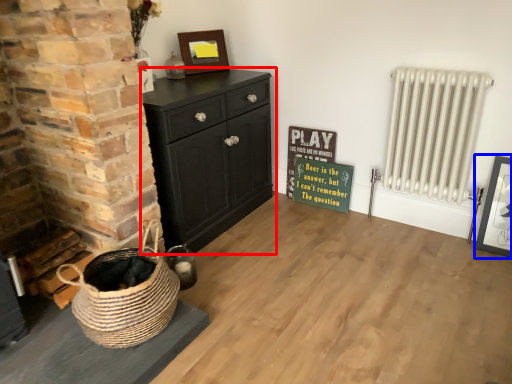
Question: Which point is further to the camera, chest of drawers (highlighted by a red box) or picture frame (highlighted by a blue box)?

Choices:
 (A) chest of drawers
 (B) picture frame

Answer: (B)